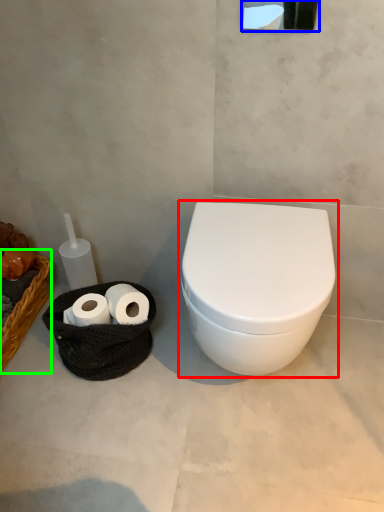
Question: Estimate the real-world distances between objects in this image. Which object is farther from toilet (highlighted by a red box), mirror (highlighted by a blue box) or basket (highlighted by a green box)?

Choices:
 (A) mirror
 (B) basket

Answer: (B)